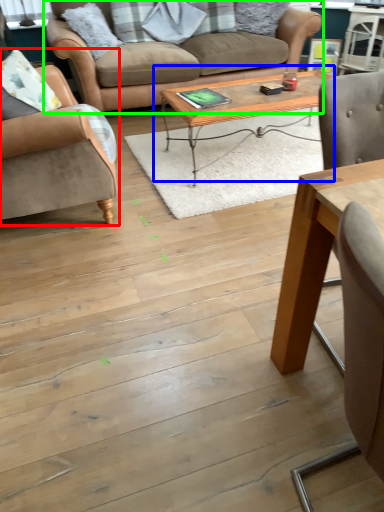
Question: Estimate the real-world distances between objects in this image. Which object is closer to chair (highlighted by a red box), coffee table (highlighted by a blue box) or studio couch (highlighted by a green box)?

Choices:
 (A) coffee table
 (B) studio couch

Answer: (A)